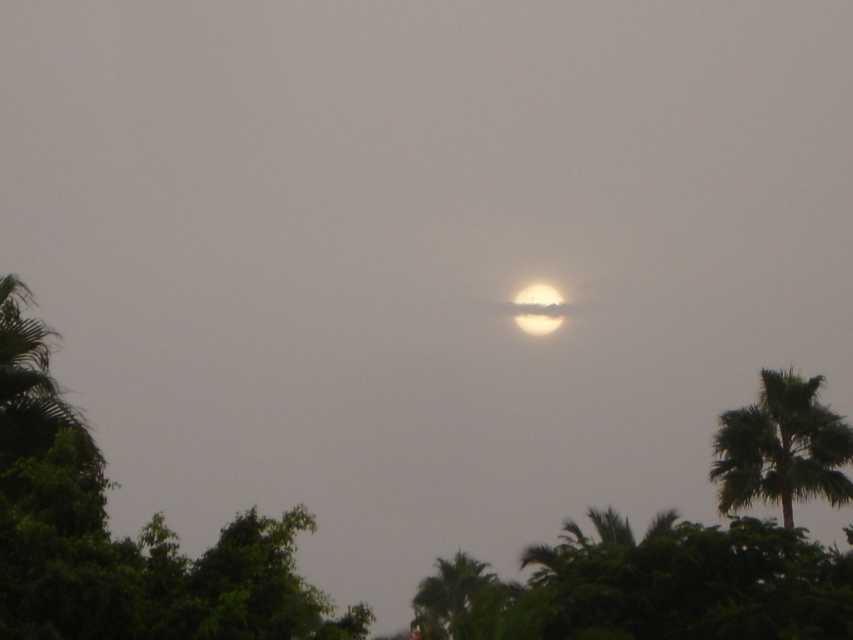
Question: Is green leafy palm tree at right positioned at the back of fuzzy white sun at center?

Choices:
 (A) no
 (B) yes

Answer: (A)

Question: Which of the following is the closest to the observer?

Choices:
 (A) fuzzy white sun at center
 (B) matte yellow moon at center
 (C) green leafy palm tree at right

Answer: (C)

Question: Does green leafy palm tree at right appear over fuzzy white sun at center?

Choices:
 (A) no
 (B) yes

Answer: (A)

Question: Which object appears closest to the camera in this image?

Choices:
 (A) matte yellow moon at center
 (B) fuzzy white sun at center

Answer: (A)

Question: Is fuzzy white sun at center smaller than matte yellow moon at center?

Choices:
 (A) yes
 (B) no

Answer: (B)

Question: Which of the following is the closest to the observer?

Choices:
 (A) matte yellow moon at center
 (B) fuzzy white sun at center
 (C) green leafy palm tree at lower center

Answer: (C)